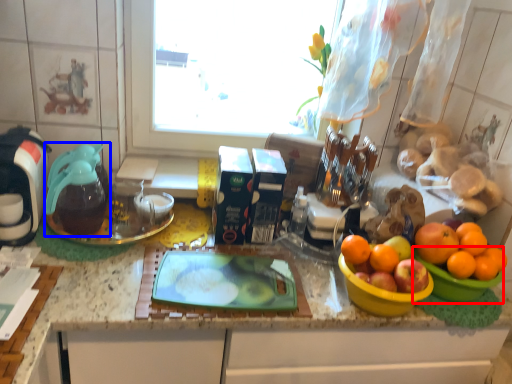
Question: Which point is closer to the camera, basin (highlighted by a red box) or coffeepot (highlighted by a blue box)?

Choices:
 (A) basin
 (B) coffeepot

Answer: (A)